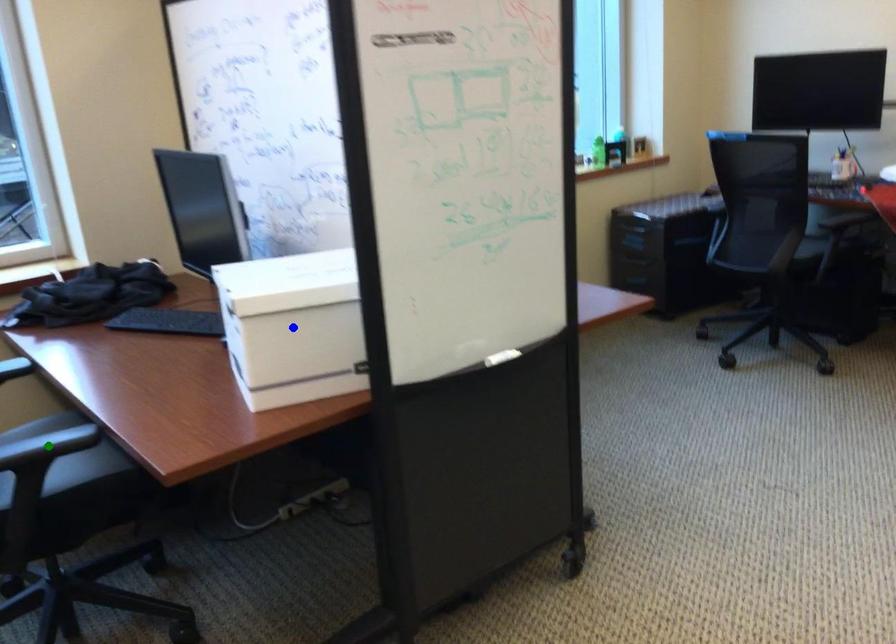
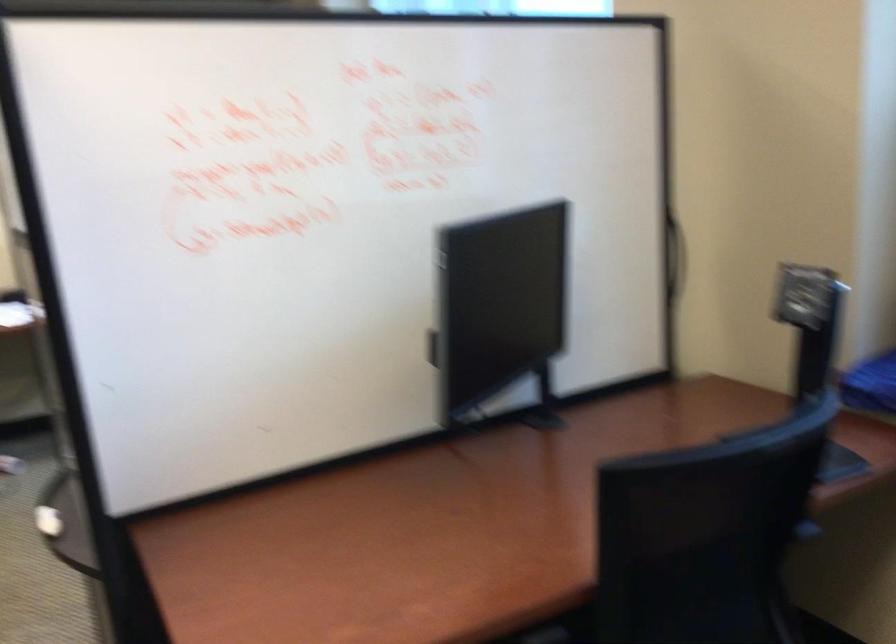
I am providing you with two images of the same scene from different viewpoints. Three points are marked in image1. Which point corresponds to a part or object that is occluded in image2?In image1, three points are marked. Which of them correspond to a part or object that is occluded in image2?Among the three points shown in image1, which one corresponds to a part or object that is no longer visible due to occlusion in image2?

yellow point, blue point, green point cannot be seen in image2.